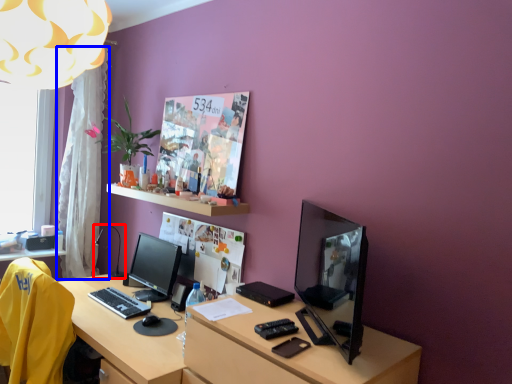
Question: Which object appears closest to the camera in this image, table lamp (highlighted by a red box) or curtain (highlighted by a blue box)?

Choices:
 (A) table lamp
 (B) curtain

Answer: (A)